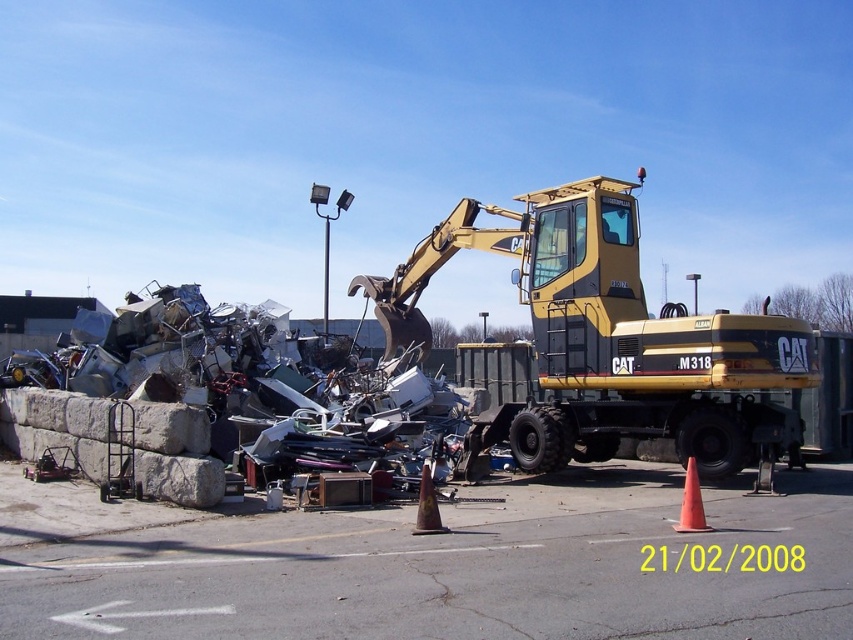
Does yellow metallic excavator at center have a greater height compared to orange matte traffic cone at center-right?

Yes.

Where is `yellow metallic excavator at center`? The height and width of the screenshot is (640, 853). yellow metallic excavator at center is located at coordinates (605, 340).

Locate an element on the screen. The width and height of the screenshot is (853, 640). yellow metallic excavator at center is located at coordinates (605, 340).

Is orange matte traffic cone at center-right to the left of orange matte traffic cone at lower right from the viewer's perspective?

Yes, orange matte traffic cone at center-right is to the left of orange matte traffic cone at lower right.

Does orange matte traffic cone at center-right have a larger size compared to orange matte traffic cone at lower right?

Yes.

Between point (688, 468) and point (762, 451), which one is positioned in front?

Point (688, 468) is more forward.

Locate an element on the screen. The width and height of the screenshot is (853, 640). orange matte traffic cone at center-right is located at coordinates (691, 502).

Based on the photo, does yellow metallic excavator at center have a greater height compared to brown matte traffic cone at center?

Yes.

Describe the element at coordinates (605, 340) in the screenshot. I see `yellow metallic excavator at center` at that location.

Between point (596, 394) and point (422, 513), which one is positioned behind?

The point (596, 394) is behind.

The image size is (853, 640). I want to click on yellow metallic excavator at center, so click(x=605, y=340).